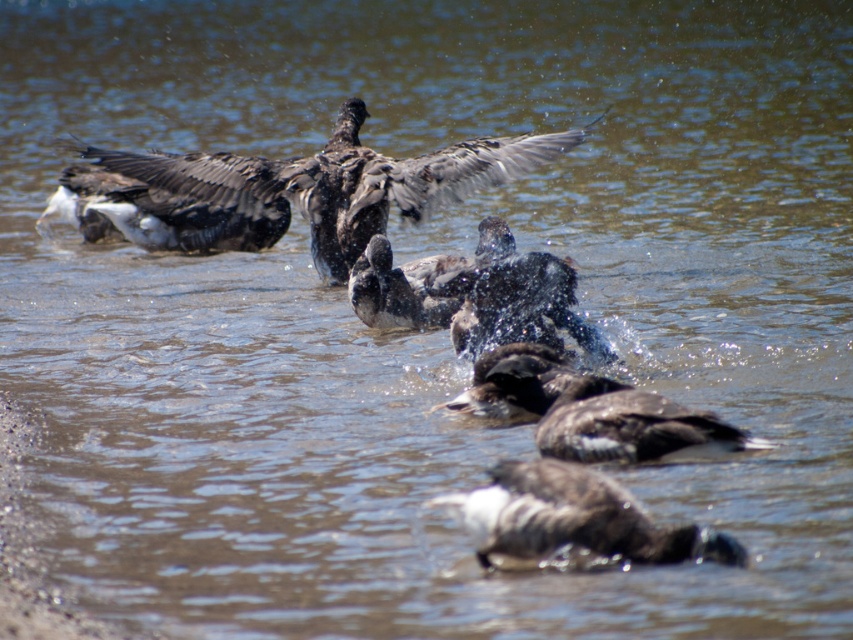
Question: Does dark gray feathers at center have a greater width compared to dark brown feathers at center?

Choices:
 (A) yes
 (B) no

Answer: (A)

Question: Is dark gray feathers at center positioned at the back of dark brown feathers at lower center?

Choices:
 (A) no
 (B) yes

Answer: (B)

Question: Which point is closer to the camera?

Choices:
 (A) dark brown feathers at center
 (B) dark gray feathers at center

Answer: (A)

Question: Which of these objects is positioned farthest from the dark brown feathers at lower center?

Choices:
 (A) dark gray feathers at center
 (B) dark brown feathers at center

Answer: (A)

Question: Estimate the real-world distances between objects in this image. Which object is farther from the dark brown feathers at center?

Choices:
 (A) dark brown feathers at lower center
 (B) dark gray feathers at center

Answer: (B)

Question: Can you confirm if dark brown feathers at center is smaller than dark brown feathers at lower center?

Choices:
 (A) no
 (B) yes

Answer: (A)